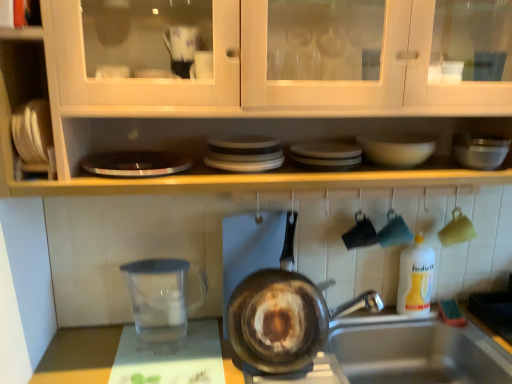
Question: Can you confirm if white plastic bottle at right is wider than white glossy bowl at upper center?

Choices:
 (A) no
 (B) yes

Answer: (A)

Question: Considering the relative sizes of white plastic bottle at right and white glossy bowl at upper center in the image provided, is white plastic bottle at right bigger than white glossy bowl at upper center?

Choices:
 (A) yes
 (B) no

Answer: (A)

Question: From a real-world perspective, is white plastic bottle at right on white glossy bowl at upper center?

Choices:
 (A) no
 (B) yes

Answer: (A)

Question: From a real-world perspective, is white plastic bottle at right beneath white glossy bowl at upper center?

Choices:
 (A) no
 (B) yes

Answer: (B)

Question: Does white plastic bottle at right lie in front of white glossy bowl at upper center?

Choices:
 (A) no
 (B) yes

Answer: (A)

Question: Considering the positions of point (353, 365) and point (476, 155), is point (353, 365) closer or farther from the camera than point (476, 155)?

Choices:
 (A) closer
 (B) farther

Answer: (B)

Question: Considering the positions of silver metallic sink at lower right and metallic silver mixing bowl at upper right in the image, is silver metallic sink at lower right wider or thinner than metallic silver mixing bowl at upper right?

Choices:
 (A) thin
 (B) wide

Answer: (B)

Question: Is silver metallic sink at lower right inside the boundaries of metallic silver mixing bowl at upper right, or outside?

Choices:
 (A) outside
 (B) inside

Answer: (A)

Question: From a real-world perspective, is silver metallic sink at lower right positioned above or below metallic silver mixing bowl at upper right?

Choices:
 (A) above
 (B) below

Answer: (B)

Question: Is point (391, 365) closer or farther from the camera than point (113, 352)?

Choices:
 (A) closer
 (B) farther

Answer: (B)

Question: In terms of height, does silver metallic sink at lower right look taller or shorter compared to transparent glass water at lower left?

Choices:
 (A) tall
 (B) short

Answer: (A)

Question: Based on their sizes in the image, would you say silver metallic sink at lower right is bigger or smaller than transparent glass water at lower left?

Choices:
 (A) small
 (B) big

Answer: (B)

Question: In the image, is silver metallic sink at lower right positioned in front of or behind transparent glass water at lower left?

Choices:
 (A) behind
 (B) front

Answer: (B)

Question: Considering the positions of point (254, 365) and point (148, 317), is point (254, 365) closer or farther from the camera than point (148, 317)?

Choices:
 (A) farther
 (B) closer

Answer: (B)

Question: Considering the relative positions of rusty metal frying pan at center and transparent plastic measuring cup at lower left in the image provided, is rusty metal frying pan at center to the left or to the right of transparent plastic measuring cup at lower left?

Choices:
 (A) left
 (B) right

Answer: (B)